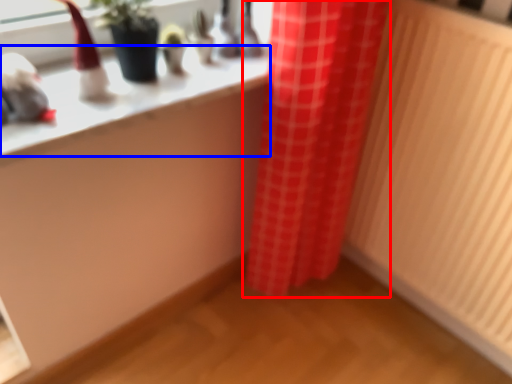
Question: Which object is closer to the camera taking this photo, curtain (highlighted by a red box) or counter top (highlighted by a blue box)?

Choices:
 (A) curtain
 (B) counter top

Answer: (B)